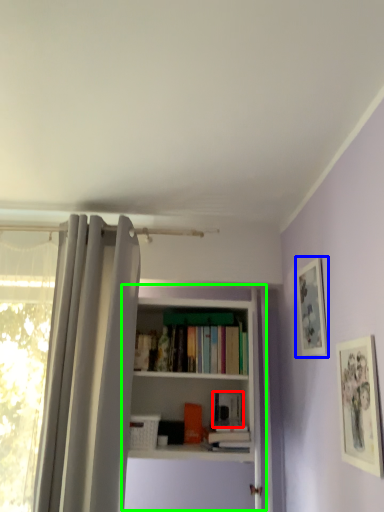
Question: Estimate the real-world distances between objects in this image. Which object is closer to book (highlighted by a red box), picture frame (highlighted by a blue box) or bookcase (highlighted by a green box)?

Choices:
 (A) picture frame
 (B) bookcase

Answer: (B)